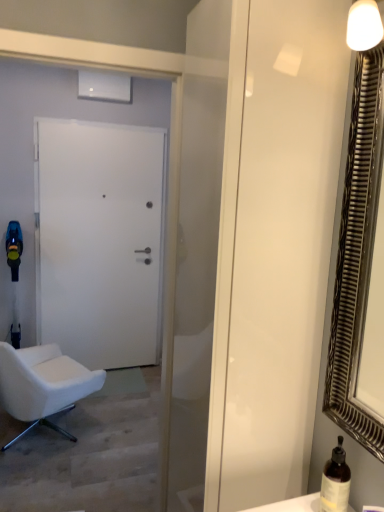
Question: Is brown glass bottle at lower right positioned far away from metallic silver mirror at right?

Choices:
 (A) no
 (B) yes

Answer: (A)

Question: Is metallic silver mirror at right inside brown glass bottle at lower right?

Choices:
 (A) no
 (B) yes

Answer: (A)

Question: Is brown glass bottle at lower right taller than metallic silver mirror at right?

Choices:
 (A) no
 (B) yes

Answer: (A)

Question: Is brown glass bottle at lower right to the left of metallic silver mirror at right from the viewer's perspective?

Choices:
 (A) yes
 (B) no

Answer: (A)

Question: Does brown glass bottle at lower right have a smaller size compared to metallic silver mirror at right?

Choices:
 (A) no
 (B) yes

Answer: (B)

Question: Can you confirm if brown glass bottle at lower right is thinner than metallic silver mirror at right?

Choices:
 (A) no
 (B) yes

Answer: (A)

Question: Is metallic silver mirror at right surrounding white matte door at center?

Choices:
 (A) yes
 (B) no

Answer: (B)

Question: Would you say metallic silver mirror at right is outside white matte door at center?

Choices:
 (A) no
 (B) yes

Answer: (B)

Question: Is metallic silver mirror at right smaller than white matte door at center?

Choices:
 (A) no
 (B) yes

Answer: (B)

Question: From the image's perspective, is metallic silver mirror at right below white matte door at center?

Choices:
 (A) no
 (B) yes

Answer: (A)

Question: From a real-world perspective, is metallic silver mirror at right on white matte door at center?

Choices:
 (A) yes
 (B) no

Answer: (A)

Question: Is metallic silver mirror at right to the right of white matte door at center from the viewer's perspective?

Choices:
 (A) yes
 (B) no

Answer: (A)

Question: Does metallic silver mirror at right have a greater width compared to brown glass bottle at lower right?

Choices:
 (A) yes
 (B) no

Answer: (B)